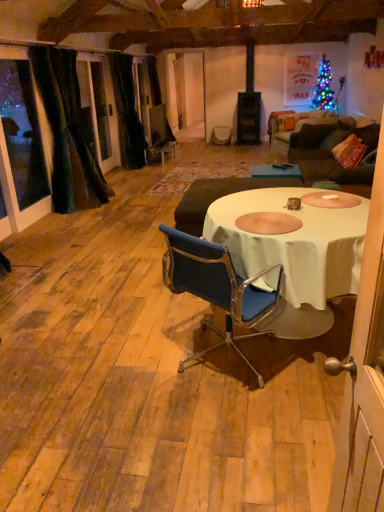
Question: Does white cloth table at center have a lesser height compared to velvet dark green curtain at left, the 1th curtain from the front?

Choices:
 (A) no
 (B) yes

Answer: (B)

Question: Would you say white cloth table at center is outside velvet dark green curtain at left, acting as the second curtain starting from the back?

Choices:
 (A) yes
 (B) no

Answer: (A)

Question: Can you confirm if white cloth table at center is positioned to the left of velvet dark green curtain at left, acting as the second curtain starting from the back?

Choices:
 (A) yes
 (B) no

Answer: (B)

Question: Can you confirm if white cloth table at center is thinner than velvet dark green curtain at left, acting as the second curtain starting from the back?

Choices:
 (A) yes
 (B) no

Answer: (B)

Question: Is white cloth table at center taller than velvet dark green curtain at left, acting as the second curtain starting from the back?

Choices:
 (A) no
 (B) yes

Answer: (A)

Question: Is white cloth table at center surrounding velvet dark green curtain at left, acting as the second curtain starting from the back?

Choices:
 (A) no
 (B) yes

Answer: (A)

Question: Is dark brown fabric couch at right outside black velvet curtain at left, the 2th curtain viewed from the front?

Choices:
 (A) yes
 (B) no

Answer: (A)

Question: Is black velvet curtain at left, the 2th curtain viewed from the front, at the back of dark brown fabric couch at right?

Choices:
 (A) yes
 (B) no

Answer: (B)

Question: Considering the relative sizes of dark brown fabric couch at right and black velvet curtain at left, the 2th curtain viewed from the front, in the image provided, is dark brown fabric couch at right taller than black velvet curtain at left, the 2th curtain viewed from the front,?

Choices:
 (A) yes
 (B) no

Answer: (B)

Question: Considering the relative sizes of dark brown fabric couch at right and black velvet curtain at left, which is counted as the first curtain, starting from the back, in the image provided, is dark brown fabric couch at right thinner than black velvet curtain at left, which is counted as the first curtain, starting from the back,?

Choices:
 (A) yes
 (B) no

Answer: (A)

Question: Considering the relative sizes of dark brown fabric couch at right and black velvet curtain at left, which is counted as the first curtain, starting from the back, in the image provided, is dark brown fabric couch at right shorter than black velvet curtain at left, which is counted as the first curtain, starting from the back,?

Choices:
 (A) no
 (B) yes

Answer: (B)

Question: Is dark brown fabric couch at right oriented towards black velvet curtain at left, which is counted as the first curtain, starting from the back?

Choices:
 (A) no
 (B) yes

Answer: (A)

Question: Can you confirm if white cloth table at center is shorter than velvet dark brown armchair at center?

Choices:
 (A) no
 (B) yes

Answer: (A)